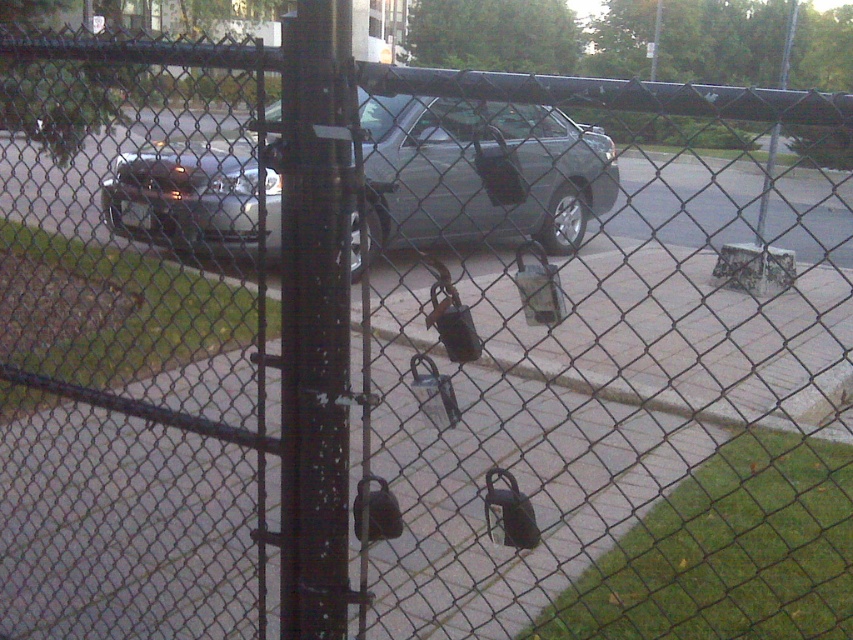
What do you see at coordinates (480, 172) in the screenshot?
I see `metallic gray car at center` at bounding box center [480, 172].

Which is behind, point (572, 182) or point (293, 561)?

The point (572, 182) is more distant.

Where is `metallic gray car at center`? metallic gray car at center is located at coordinates (480, 172).